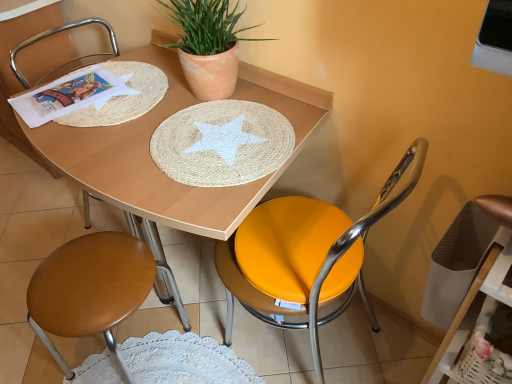
The image size is (512, 384). I want to click on free region on the left part of matte terracotta pot at upper center, so pyautogui.click(x=132, y=106).